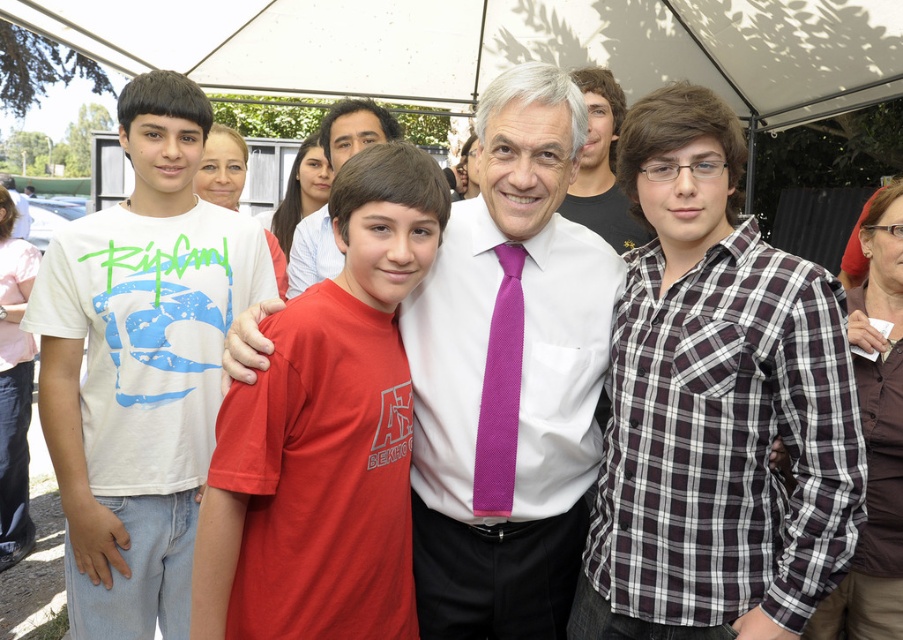
You are standing at the position of the photographer and want to place a small decoration between the two points labeled point [697,486] and point [361,531]. Which point should the decoration be closer to in order to appear larger in the photo?

The decoration should be placed closer to point [697,486] because it is closer to the viewer, making it appear larger in the photo compared to point [361,531] which is farther away.